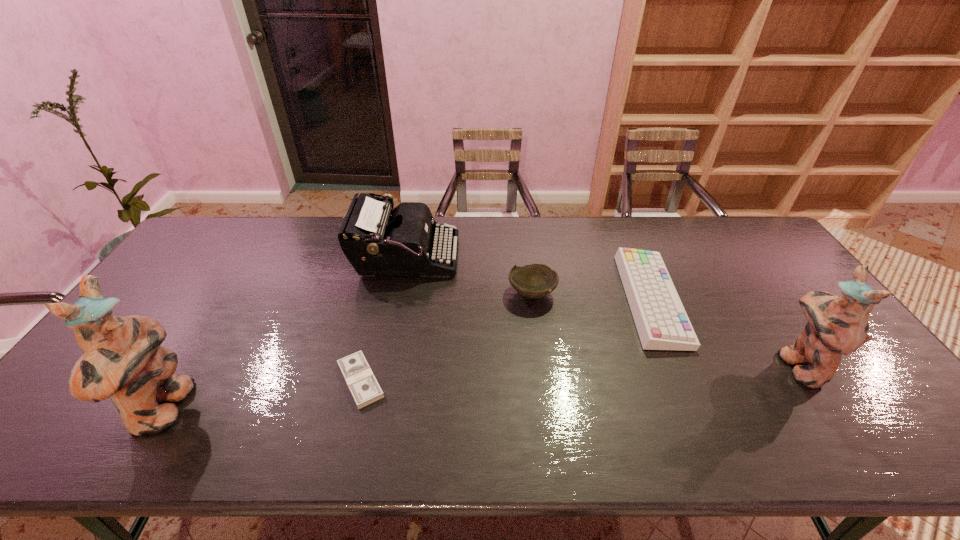
Locate an element on the screen. vacant position for inserting another figurine evenly is located at coordinates (495, 387).